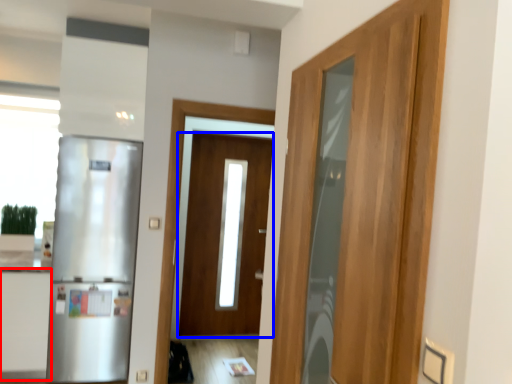
Question: Which object is closer to the camera taking this photo, cabinetry (highlighted by a red box) or door (highlighted by a blue box)?

Choices:
 (A) cabinetry
 (B) door

Answer: (A)